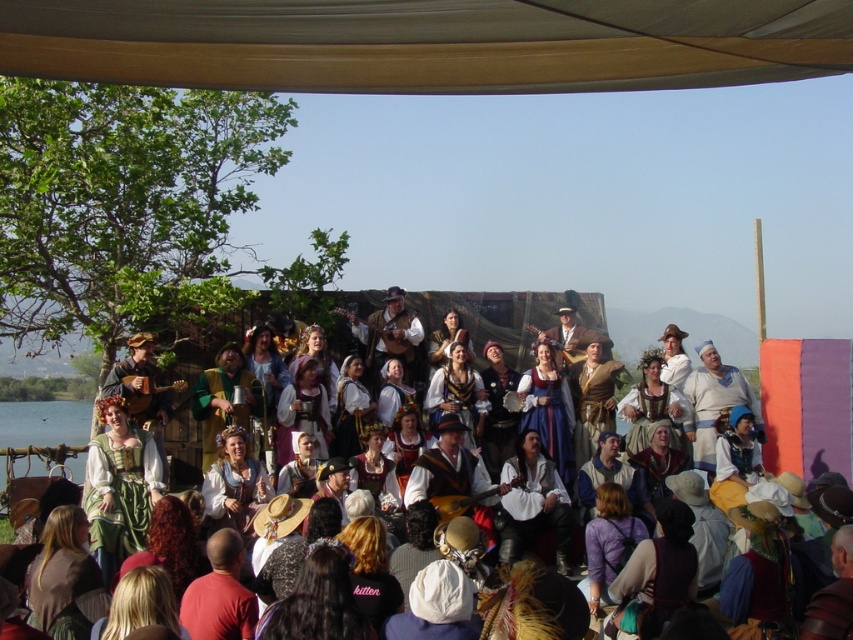
Can you confirm if gray fabric canopy at upper center is positioned to the left of white cotton dress at center?

Incorrect, gray fabric canopy at upper center is not on the left side of white cotton dress at center.

Looking at this image, between gray fabric canopy at upper center and white cotton dress at center, which one has less height?

gray fabric canopy at upper center is shorter.

Between point (531, 72) and point (817, 472), which one is positioned behind?

The point (817, 472) is behind.

Find the location of a particular element. The height and width of the screenshot is (640, 853). gray fabric canopy at upper center is located at coordinates (426, 44).